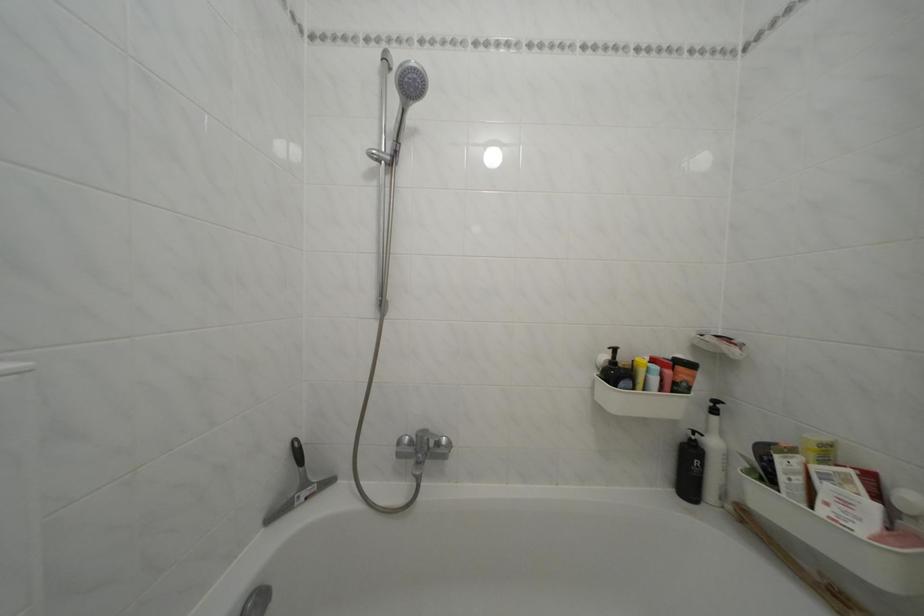
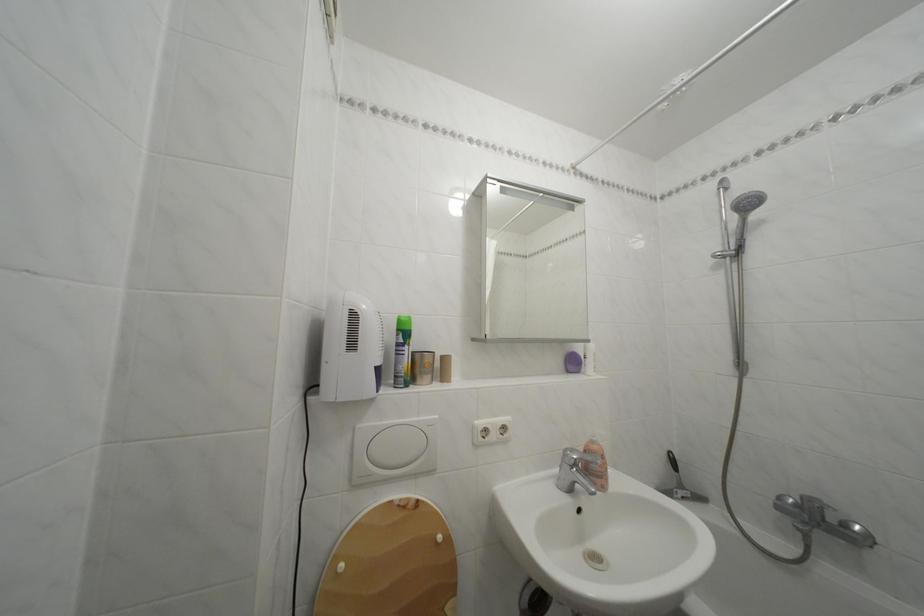
In the second image, find the point that corresponds to point (420, 450) in the first image.

(806, 512)